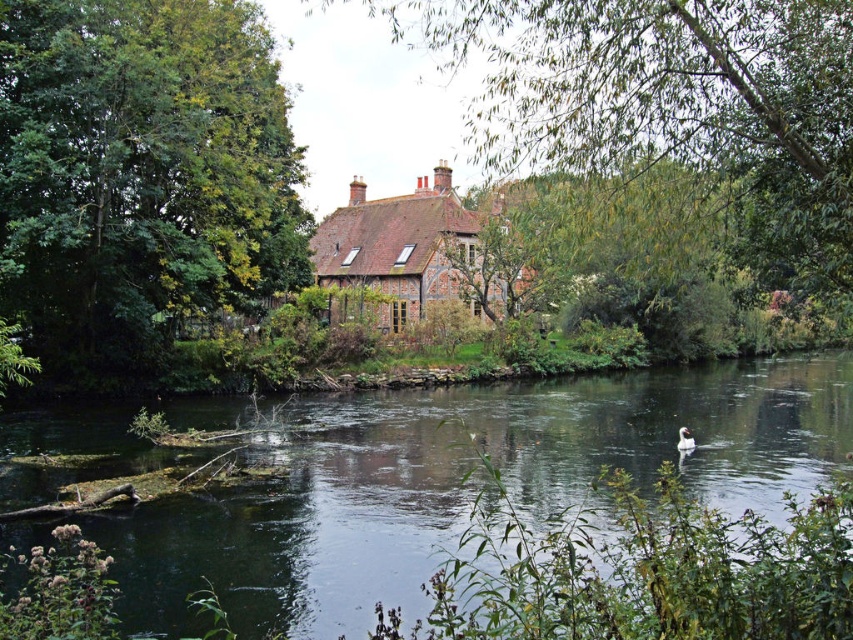
You are standing at the riverside and want to take a photo of both the green leafy tree at center and the brown brick cottage at center. Which object should you position closer to the camera to ensure both are in focus?

Since the green leafy tree at center is in front of the brown brick cottage at center, you should position the green leafy tree at center closer to the camera to ensure both are in focus.

You are standing at the riverside looking at the scene. There are two points marked in the image. One is at coordinates point [125,369] and the other is at point [317,240]. Which point is closer to you?

Point [125,369] is closer to the viewer than point [317,240].